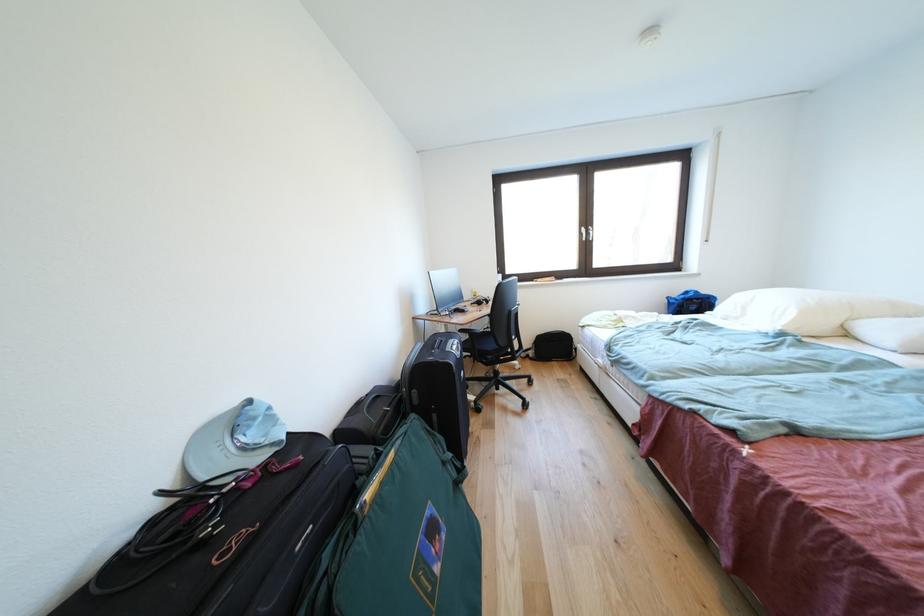
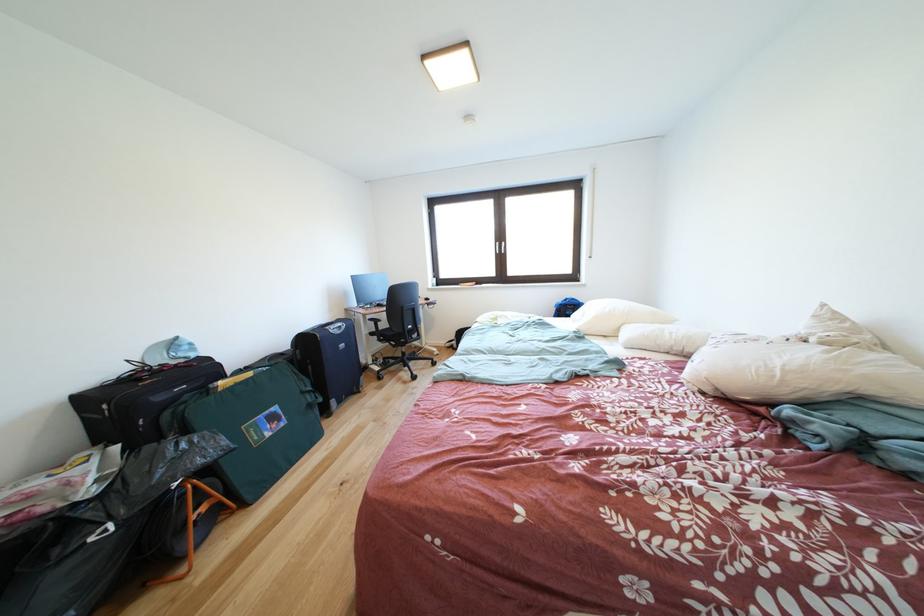
Where in the second image is the point corresponding to the point at 495,369 from the first image?

(403, 351)